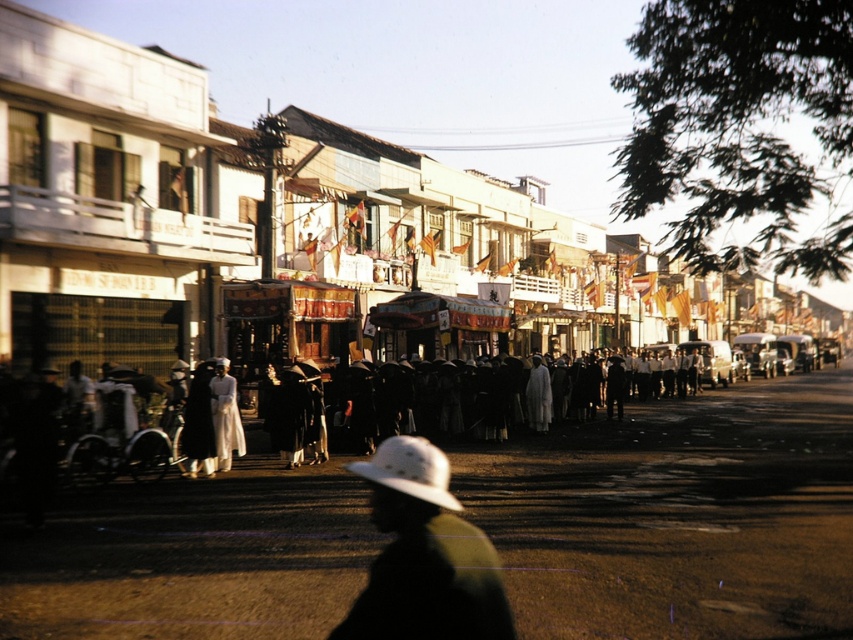
Question: Which of the following is the closest to the observer?

Choices:
 (A) white felt hat at center
 (B) white satin dress at center

Answer: (A)

Question: Is white felt hat at center in front of white satin dress at center?

Choices:
 (A) no
 (B) yes

Answer: (B)

Question: In this image, where is white felt hat at center located relative to white satin dress at center?

Choices:
 (A) above
 (B) below

Answer: (B)

Question: Is white felt hat at center thinner than white satin dress at center?

Choices:
 (A) no
 (B) yes

Answer: (A)

Question: Which point is farther to the camera?

Choices:
 (A) white felt hat at center
 (B) white satin dress at center

Answer: (B)

Question: Which point appears closest to the camera in this image?

Choices:
 (A) (210, 384)
 (B) (439, 449)

Answer: (A)